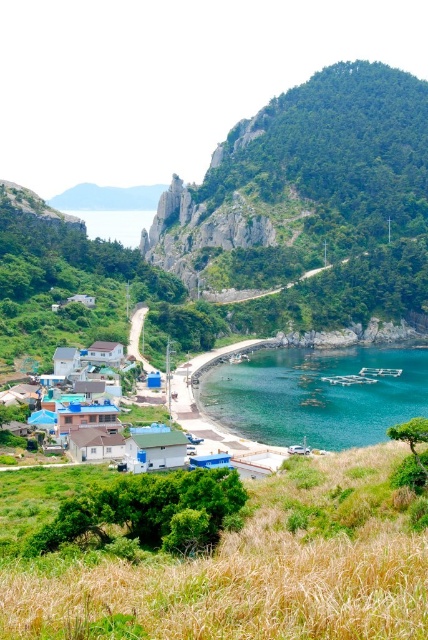
You are a tourist standing at the top of the grassy slope in the foreground of the coastal village. You want to take a photo of the blue matte hut at center without the clear blue water at lower center blocking the view. Which direction should you move to achieve this?

The clear blue water at lower center is located above the blue matte hut at center. To avoid the water blocking the view, you should move downward towards the village so that the blue matte hut at center becomes visible below the water.

You are standing at the top of the grassy slope in the foreground of the coastal village scene. You want to walk directly to the clear blue water at lower center. According to the coordinates provided, what direction should you head in from your current position?

The clear blue water at lower center is located at coordinates point [317,394]. Since you are at the top of the grassy slope in the foreground, you should head towards the lower center direction to reach it.